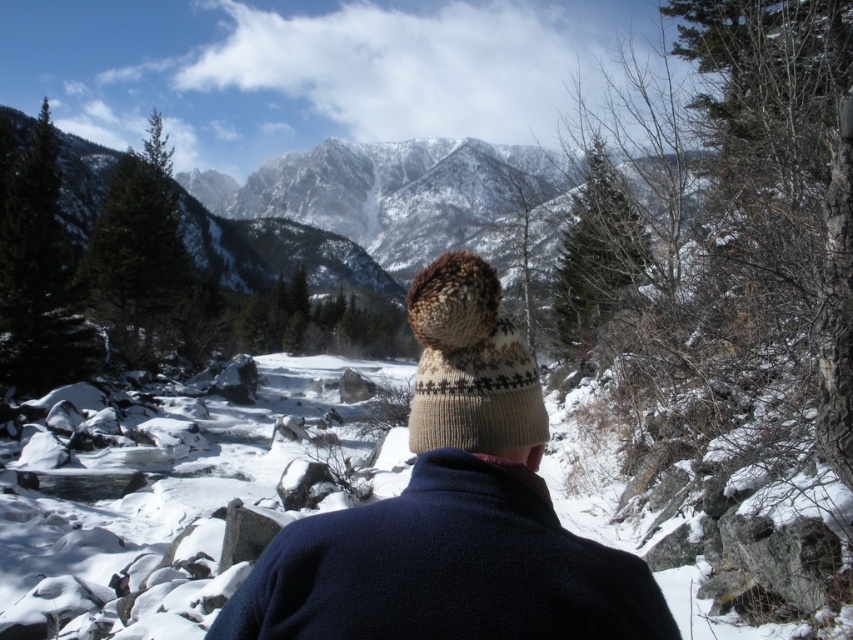
You are a photographer trying to capture the knitted wool hat at center and the knitted beige hat at center in a single frame. Since you want both hats to appear clearly, which hat should you focus on first to ensure sharpness, considering their sizes?

The knitted wool hat at center is larger in size than the knitted beige hat at center, so focusing on the larger hat first will help ensure both are in focus as it occupies more of the frame.

You are a photographer trying to capture the knitted wool hat at center and the knitted beige hat at center in a single shot. Which hat will appear larger in the photo?

The knitted wool hat at center will appear larger in the photo because it is closer to the viewer than the knitted beige hat at center.